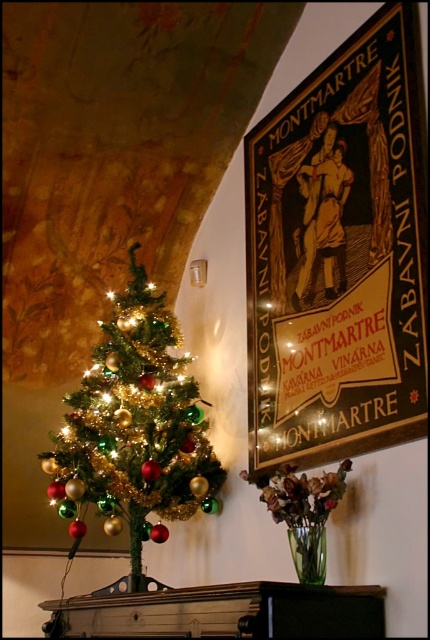
Question: Can you confirm if black glossy signboard at upper right is wider than shiny metallic christmas tree at left?

Choices:
 (A) no
 (B) yes

Answer: (A)

Question: Does black glossy signboard at upper right appear on the right side of shiny metallic christmas tree at left?

Choices:
 (A) no
 (B) yes

Answer: (B)

Question: Can you confirm if black glossy signboard at upper right is positioned to the right of shiny metallic christmas tree at left?

Choices:
 (A) no
 (B) yes

Answer: (B)

Question: Which object is farther from the camera taking this photo?

Choices:
 (A) black glossy signboard at upper right
 (B) shiny metallic christmas tree at left

Answer: (B)

Question: Which point appears closest to the camera in this image?

Choices:
 (A) (119, 458)
 (B) (374, 248)

Answer: (B)

Question: Which object is farther from the camera taking this photo?

Choices:
 (A) black glossy signboard at upper right
 (B) shiny metallic christmas tree at left

Answer: (B)